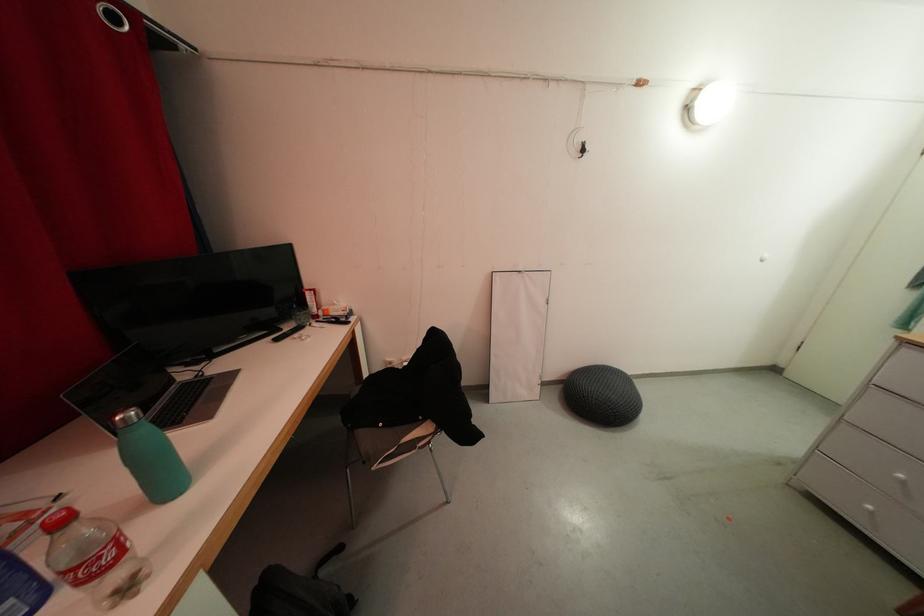
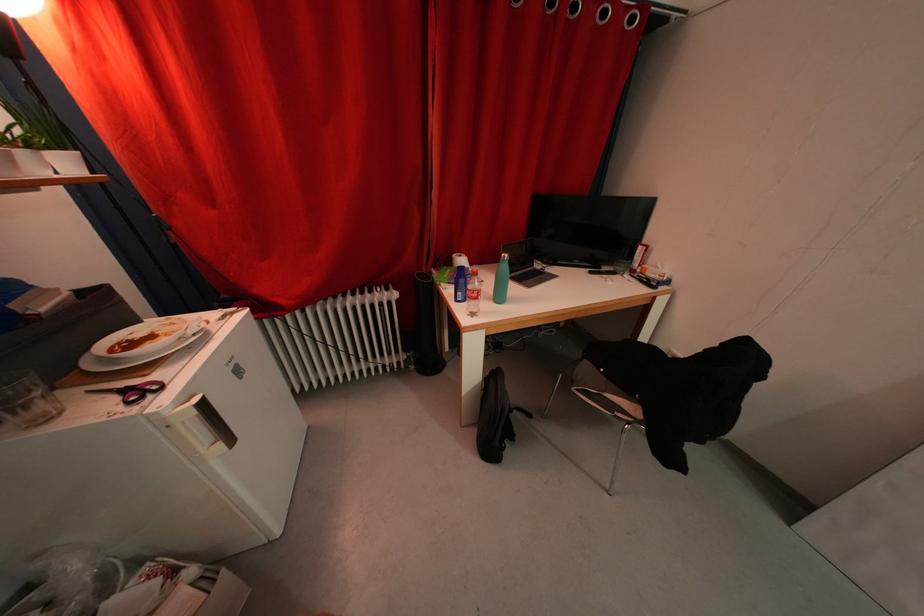
Where in the second image is the point corresponding to point (420, 427) from the first image?

(636, 399)